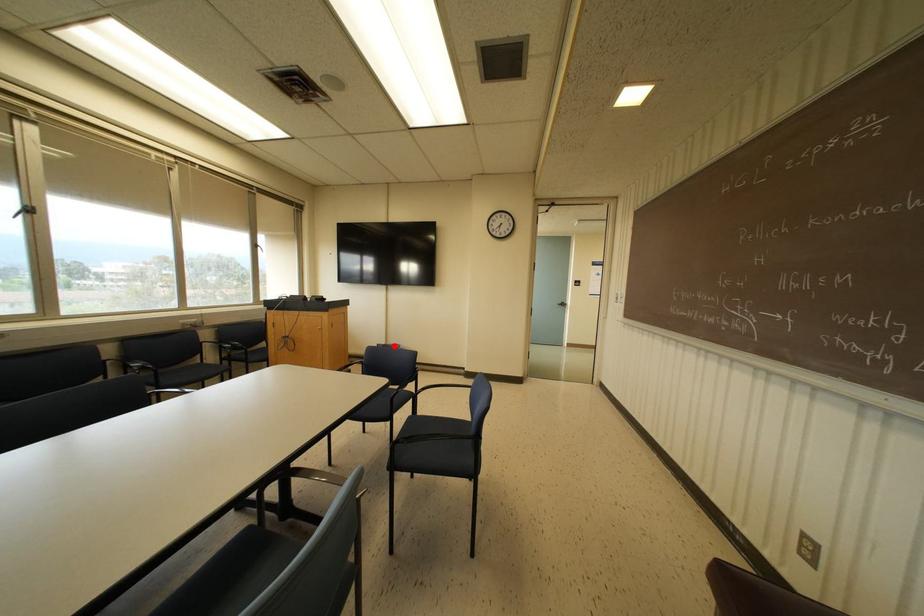
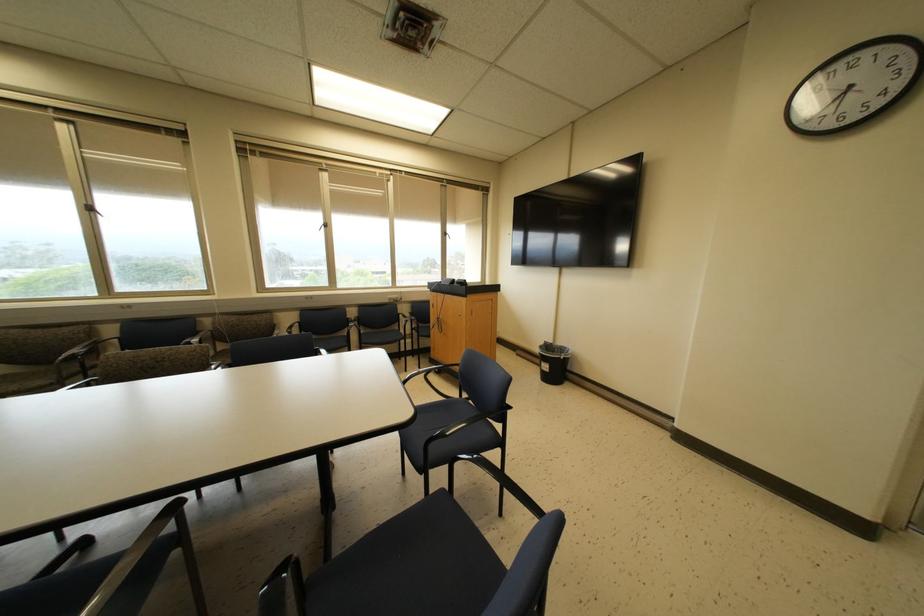
Question: I am providing you with two images of the same scene from different viewpoints. A red point is shown in image1. For the corresponding object point in image2, is it positioned nearer or farther from the camera?

Choices:
 (A) Nearer
 (B) Farther

Answer: (A)